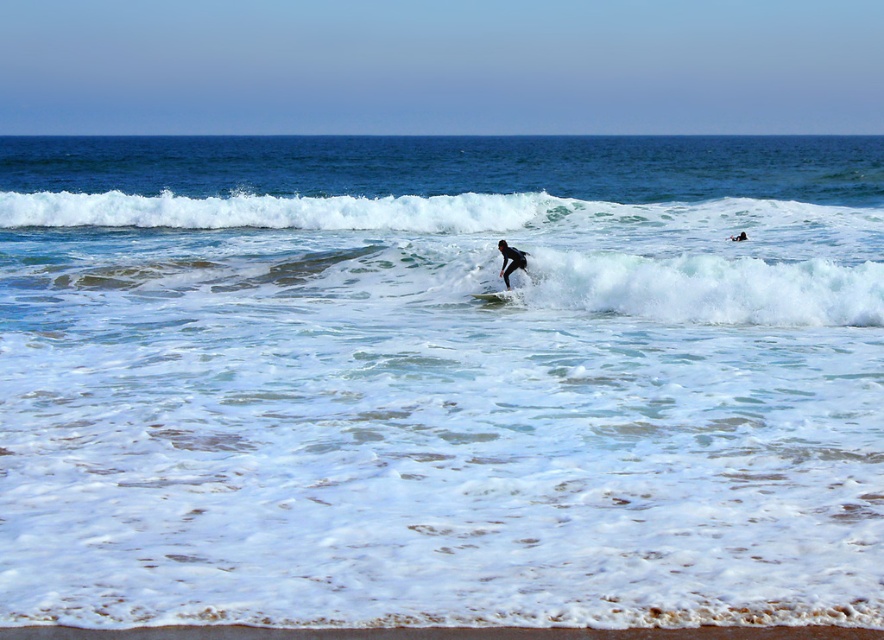
You are standing on the beach and see two points marked in the image. Which point, point (508, 268) or point (486, 294), is closer to you?

Point (508, 268) is closer to the viewer than point (486, 294).

Looking at this image, you are a swimmer who wants to avoid getting hit by the white foamy wave at upper center. You are currently standing next to the black rubber wetsuit at center. Can you move to the side before the wave reaches you? Explain why or why not based on their sizes.

The white foamy wave at upper center is wider than the black rubber wetsuit at center. Since the wave is wider, it covers a larger area, making it harder to avoid by moving to the side. Therefore, it might be challenging to move out of the way in time.